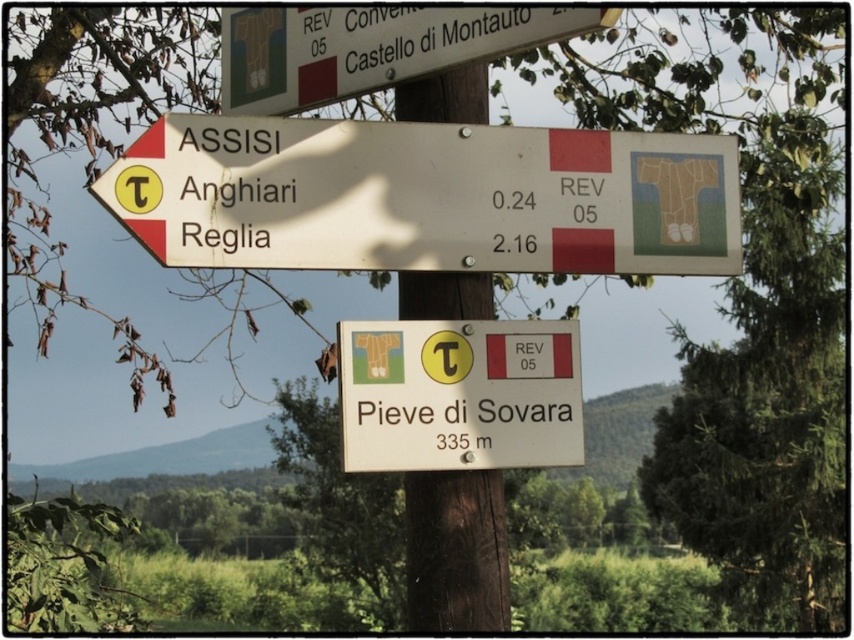
You are a hiker planning to reach the nearest town. You see a white plastic sign at center and a brown wood pole at center. Which object should you look at to find directions to Assisi?

The white plastic sign at center is positioned on the right side of brown wood pole at center. The sign pointing leftwards toward Assisi is on the white plastic sign at center, so you should look at the white plastic sign at center for directions to Assisi.

You are a hiker trying to decide which direction to take next. You see a white matte sign at upper left and a brown wood pole at center. Which object is shorter?

The white matte sign at upper left is shorter than the brown wood pole at center.

You are a hiker approaching the wooden post with signs. You see the white plastic sign at center and the white plastic sign at upper center. Which sign is closer to you?

The white plastic sign at center is closer to you because it is further to the viewer than the white plastic sign at upper center, meaning it appears in front of the upper one.